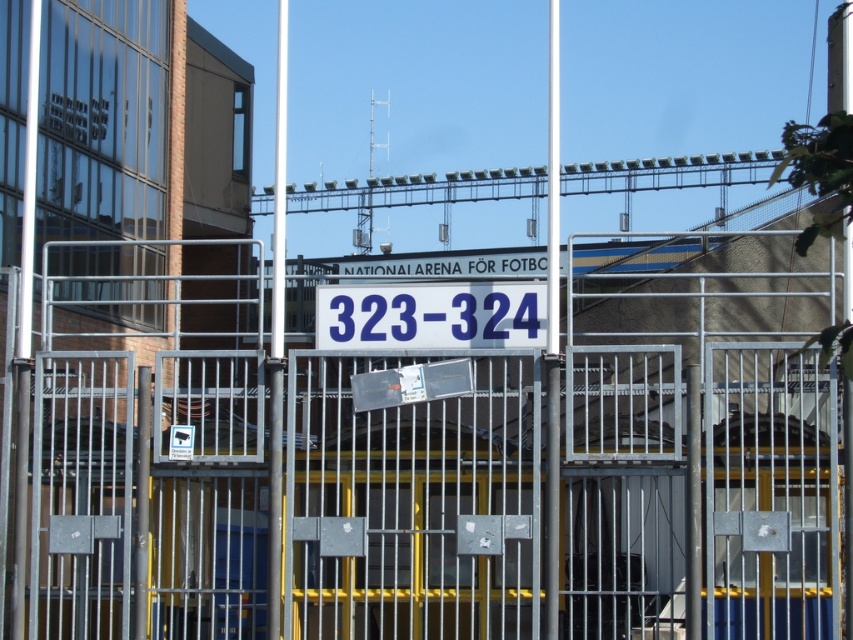
Question: Is metallic gate at center wider than blue plastic sign at center?

Choices:
 (A) yes
 (B) no

Answer: (A)

Question: Can you confirm if metallic gate at center is thinner than blue plastic sign at center?

Choices:
 (A) yes
 (B) no

Answer: (B)

Question: Which object appears closest to the camera in this image?

Choices:
 (A) metallic gate at center
 (B) blue plastic sign at center

Answer: (A)

Question: Is metallic gate at center closer to camera compared to blue plastic sign at center?

Choices:
 (A) yes
 (B) no

Answer: (A)